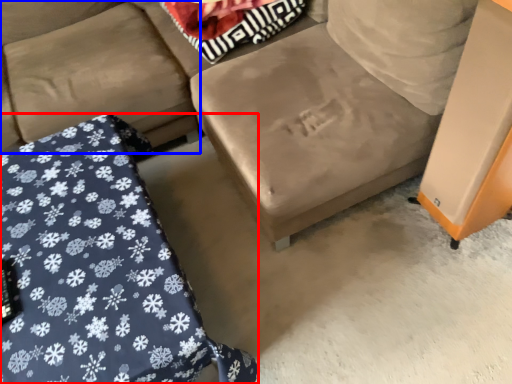
Question: Among these objects, which one is nearest to the camera, furniture (highlighted by a red box) or couch (highlighted by a blue box)?

Choices:
 (A) furniture
 (B) couch

Answer: (A)